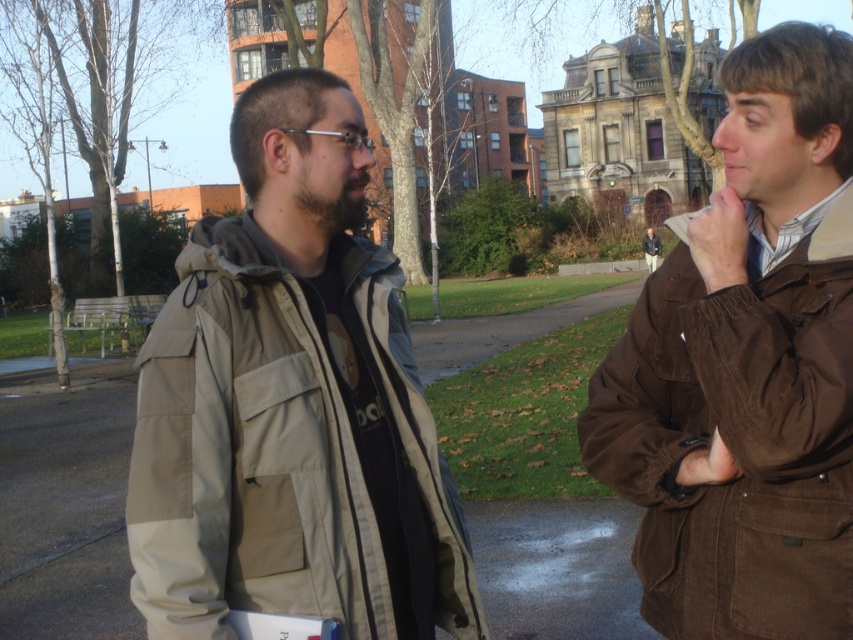
You are a tailor who needs to determine which jacket requires more fabric for alterations. Based on the image, which of the two jackets, the khaki fabric jacket at left or the brown corduroy jacket at right, would need more fabric due to its size?

The khaki fabric jacket at left has a larger size compared to the brown corduroy jacket at right, so it would require more fabric for alterations.

You are standing on the pathway in the park and see both the khaki fabric jacket at left and the brown corduroy jacket at right. Which jacket is positioned more to the east if the pathway runs from north to south?

The khaki fabric jacket at left is positioned more to the east because it is to the left of the brown corduroy jacket at right, and since the pathway runs north to south, left would correspond to the east direction.